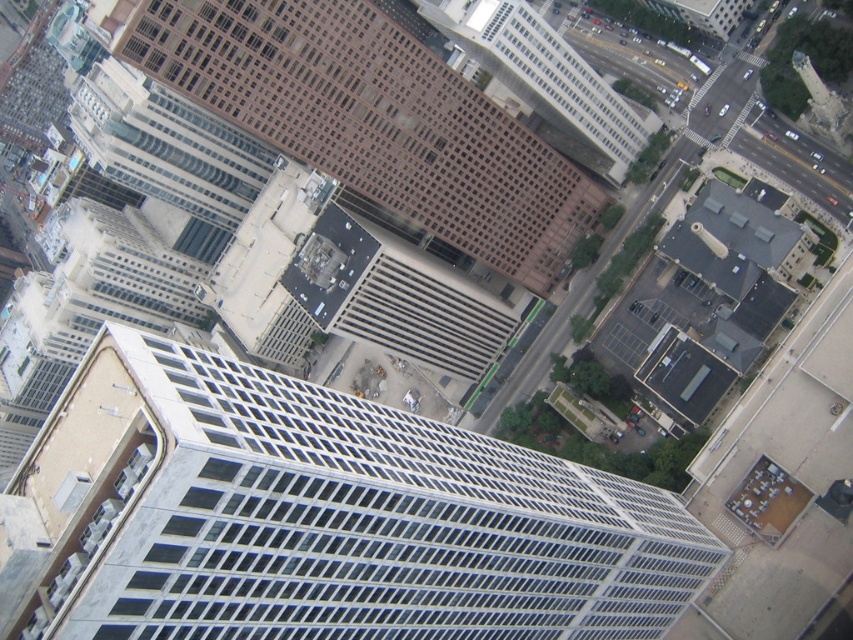
Which is above, white glass building at center or brown glassy building at upper center?

Positioned higher is brown glassy building at upper center.

Is point (466, 429) positioned in front of point (213, 10)?

No, (466, 429) is further to viewer.

Is point (103, 468) more distant than point (347, 136)?

No, it is not.

Where is `white glass building at center`? This screenshot has height=640, width=853. white glass building at center is located at coordinates (317, 516).

Between white glass building at center and brown glass building at center, which one is positioned lower?

white glass building at center is below.

Where is `white glass building at center`? The image size is (853, 640). white glass building at center is located at coordinates (317, 516).

You are a GUI agent. You are given a task and a screenshot of the screen. Output one action in this format:
    pyautogui.click(x=<x>, y=<y>)
    Task: Click on the white glass building at center
    The width and height of the screenshot is (853, 640).
    Given the screenshot: What is the action you would take?
    pyautogui.click(x=317, y=516)

Is brown glassy building at upper center bigger than brown glass building at center?

Yes.

Identify the location of brown glassy building at upper center. (370, 116).